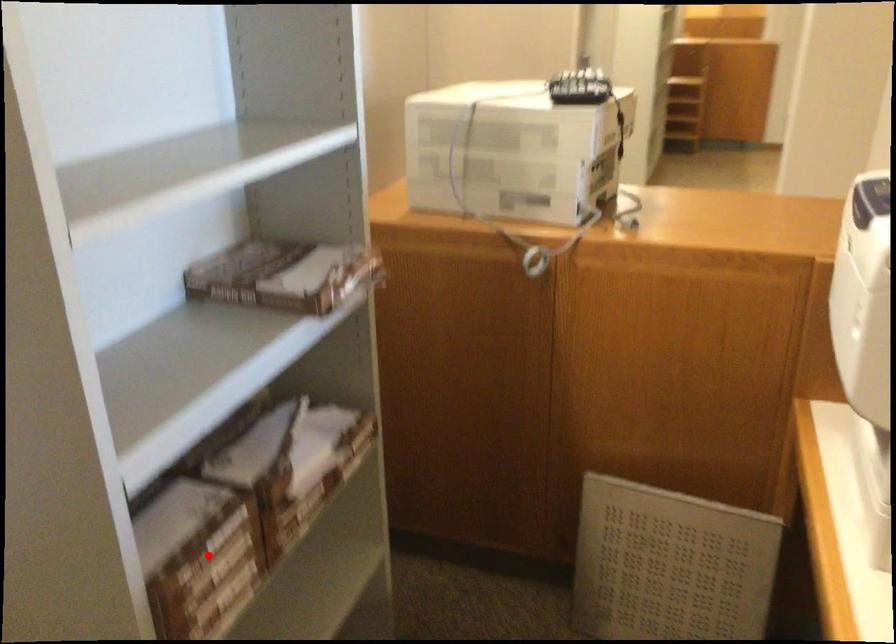
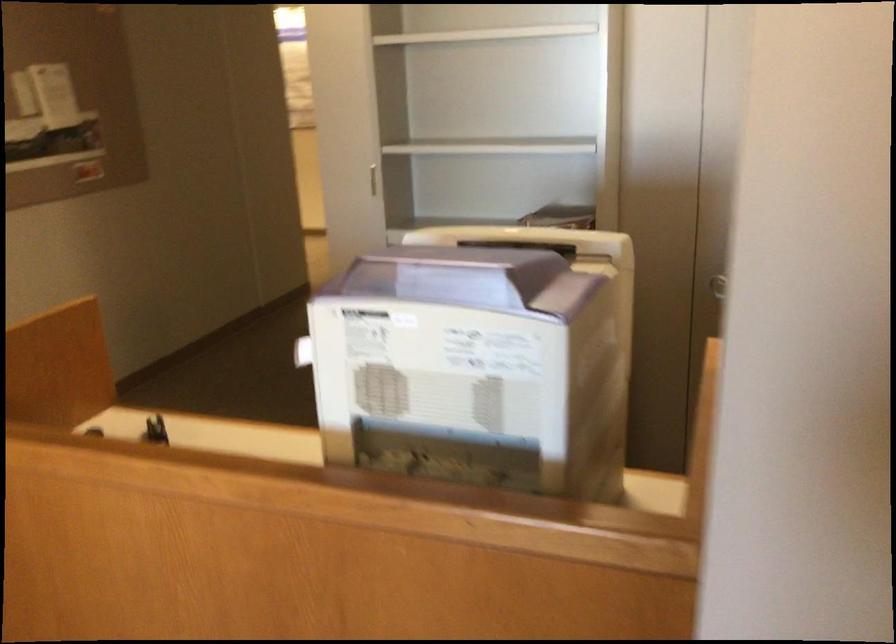
Question: I am providing you with two images of the same scene from different viewpoints. A red point is marked on the first image. At the location where the point appears in image 1, is it still visible in image 2?

Choices:
 (A) Yes
 (B) No

Answer: (B)